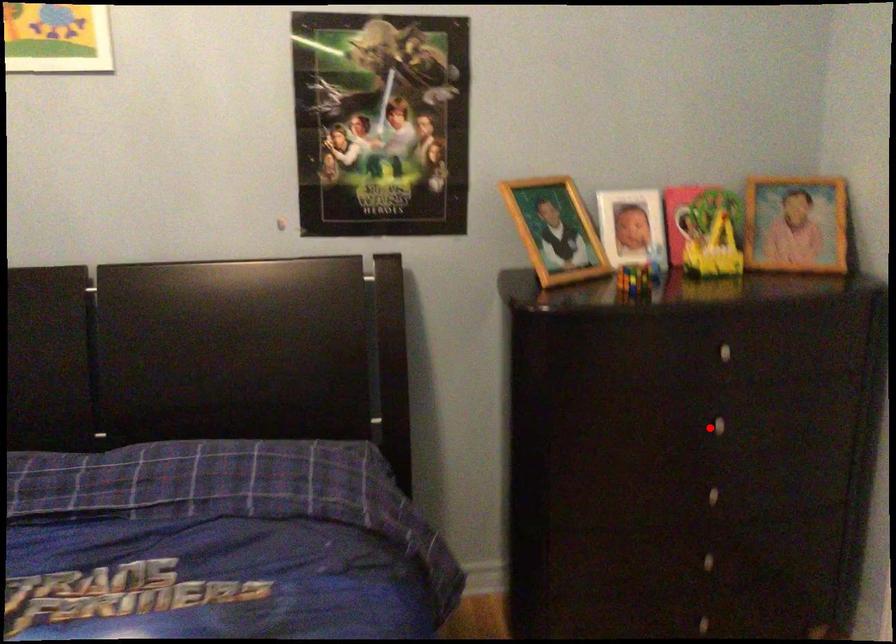
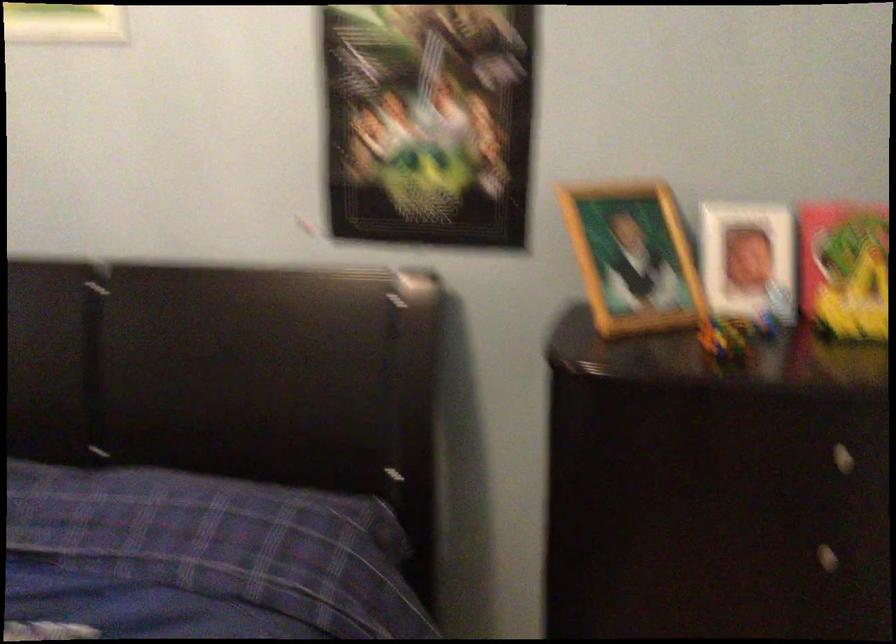
Question: A red point is marked in image1. In image2, is the corresponding 3D point closer to the camera or farther? Reply with the corresponding letter.

Choices:
 (A) The corresponding 3D point is closer.
 (B) The corresponding 3D point is farther.

Answer: (A)